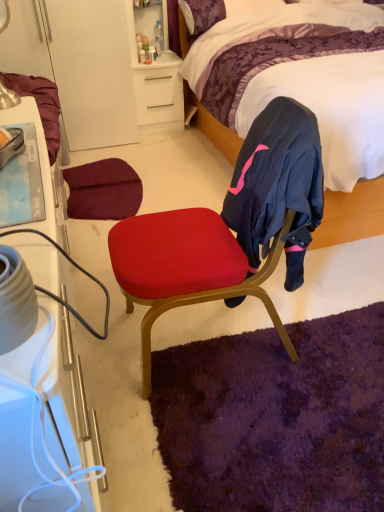
You are a GUI agent. You are given a task and a screenshot of the screen. Output one action in this format:
    pyautogui.click(x=<x>, y=<y>)
    Task: Click on the vacant point to the right of matte black sneakers at upper left
    This screenshot has width=384, height=512.
    Given the screenshot: What is the action you would take?
    pyautogui.click(x=26, y=168)